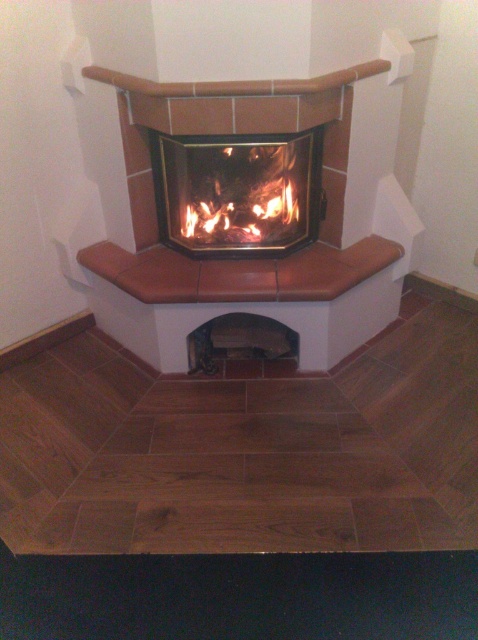
You are designing a living room layout and need to place a sofa that is 1.8 meters wide. The sofa must be positioned in front of the fireplace. Given that the matte glass fireplace at center is wider than the orange wood fire at center, will the sofa fit comfortably in front of the fireplace?

The matte glass fireplace at center is wider than the orange wood fire at center. Since the sofa is 1.8 meters wide and the fireplace is wider than the fire, the sofa should fit comfortably in front of the fireplace as long as the total width of the fireplace accommodates the sofa.

You are designing a layout for a living room and need to place a sofa. The sofa will be placed opposite the matte glass fireplace at center and orange wood fire at center. Which side of the sofa should face the fireplace to ensure the fire is visible?

The sofa should face the right side to ensure visibility of the orange wood fire at center, since the matte glass fireplace at center is positioned to its left.